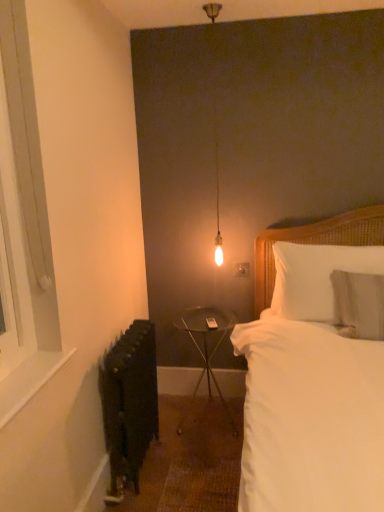
Question: Is the depth of metallic silver table at center greater than that of white cotton bed at center?

Choices:
 (A) yes
 (B) no

Answer: (A)

Question: Is metallic silver table at center bigger than white cotton bed at center?

Choices:
 (A) no
 (B) yes

Answer: (A)

Question: From the image's perspective, does metallic silver table at center appear higher than white cotton bed at center?

Choices:
 (A) yes
 (B) no

Answer: (B)

Question: From a real-world perspective, is metallic silver table at center positioned over white cotton bed at center based on gravity?

Choices:
 (A) no
 (B) yes

Answer: (A)

Question: Does metallic silver table at center have a lesser height compared to white cotton bed at center?

Choices:
 (A) yes
 (B) no

Answer: (A)

Question: From the image's perspective, is black matte radiator at lower left positioned above or below white cotton bed at center?

Choices:
 (A) below
 (B) above

Answer: (A)

Question: From a real-world perspective, is black matte radiator at lower left positioned above or below white cotton bed at center?

Choices:
 (A) below
 (B) above

Answer: (A)

Question: Relative to white cotton bed at center, is black matte radiator at lower left in front or behind?

Choices:
 (A) front
 (B) behind

Answer: (B)

Question: Considering the positions of black matte radiator at lower left and white cotton bed at center in the image, is black matte radiator at lower left taller or shorter than white cotton bed at center?

Choices:
 (A) short
 (B) tall

Answer: (A)

Question: Is white cotton bed at center bigger or smaller than white soft pillow at upper right, arranged as the second pillow when viewed from the back?

Choices:
 (A) small
 (B) big

Answer: (B)

Question: Is point (281, 480) positioned closer to the camera than point (349, 316)?

Choices:
 (A) closer
 (B) farther

Answer: (A)

Question: Relative to white soft pillow at upper right, arranged as the second pillow when viewed from the back, is white cotton bed at center in front or behind?

Choices:
 (A) behind
 (B) front

Answer: (B)

Question: From a real-world perspective, is white cotton bed at center above or below white soft pillow at upper right, arranged as the second pillow when viewed from the back?

Choices:
 (A) above
 (B) below

Answer: (B)

Question: Based on their sizes in the image, would you say white wood window at left is bigger or smaller than metallic silver table at center?

Choices:
 (A) big
 (B) small

Answer: (A)

Question: Is white wood window at left taller or shorter than metallic silver table at center?

Choices:
 (A) tall
 (B) short

Answer: (A)